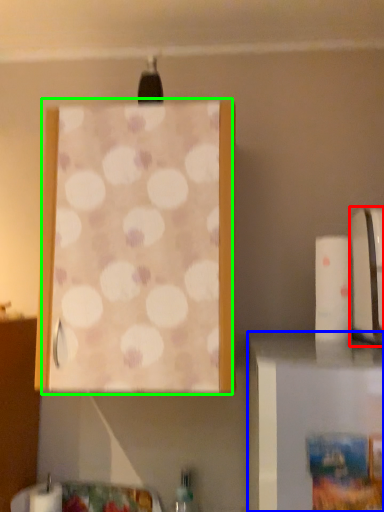
Question: Which is farther away from appliance (highlighted by a red box)? furniture (highlighted by a blue box) or curtain (highlighted by a green box)?

Choices:
 (A) furniture
 (B) curtain

Answer: (B)